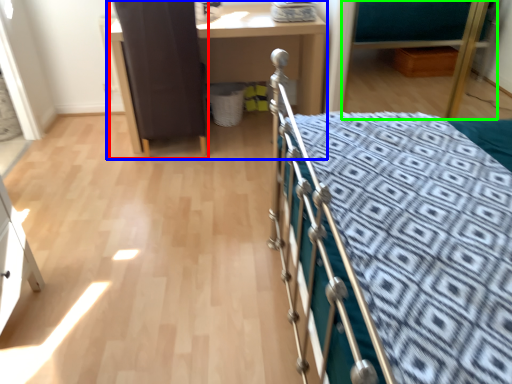
Question: Considering the real-world distances, which object is farthest from screen door (highlighted by a red box)? desk (highlighted by a blue box) or hospital bed (highlighted by a green box)?

Choices:
 (A) desk
 (B) hospital bed

Answer: (B)